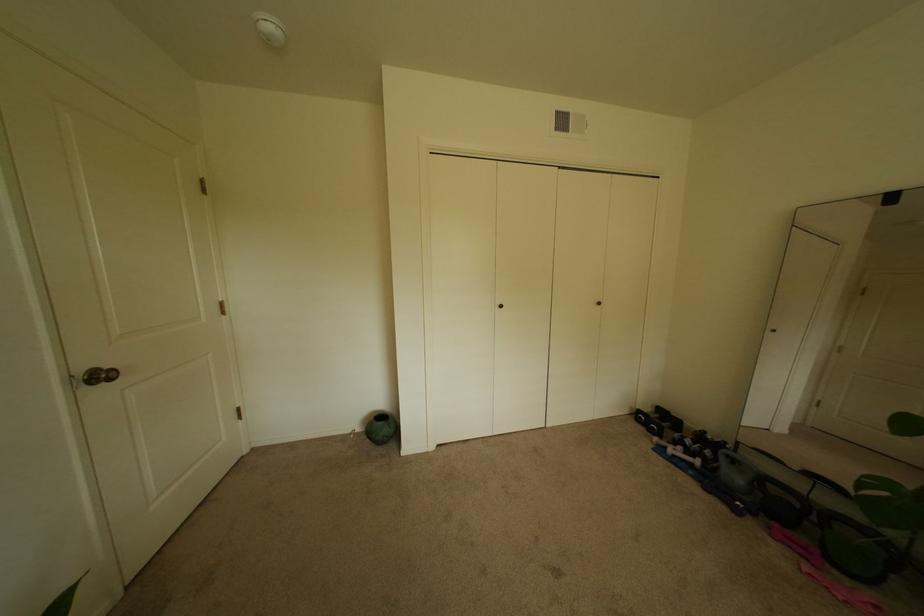
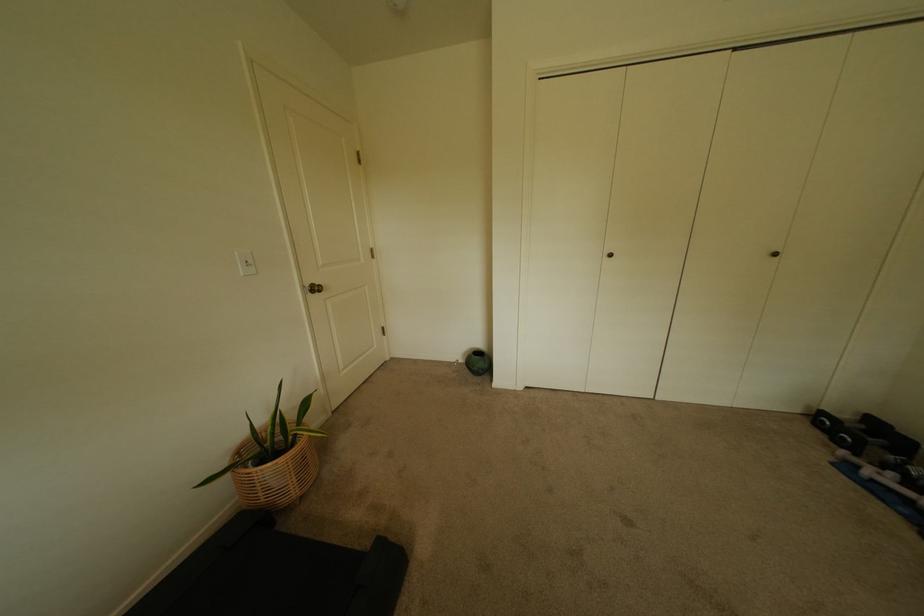
The point at (509, 307) is marked in the first image. Where is the corresponding point in the second image?

(618, 256)